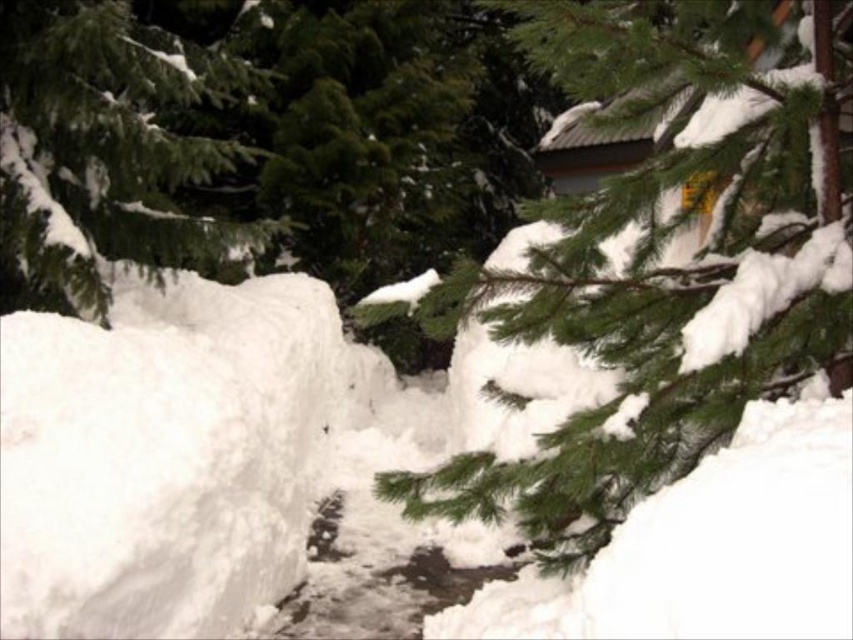
In the scene shown: You are an animal trying to find shelter from the snow. You see the white fluffy snow at center and the green matte tree branch at upper center. Which location would provide more coverage from the snow?

The green matte tree branch at upper center occupies more space than the white fluffy snow at center, so it would provide more coverage from the snow.

You are standing in the snowy winter scene and want to place a small red flag exactly at the center of the image. However, there is already white fluffy snow at center. Where should you place the flag to ensure it is as close as possible to the center without overlapping the snow?

The white fluffy snow at center is located at point (184, 452), so you should place the flag near that coordinate but slightly offset to avoid overlapping, ensuring it remains close to the center.

You are a wildlife photographer aiming to capture the entire scene of the green matte tree branch at upper center and the green matte tree at upper left in a single frame. Your camera has a maximum zoom range that allows capturing objects within a 10 feet distance. Can you fit both objects into the frame without moving the camera?

The distance between the green matte tree branch at upper center and the green matte tree at upper left is 10.65 feet, which exceeds the camera maximum zoom range of 10 feet. Therefore, you cannot fit both objects into the frame without moving the camera.